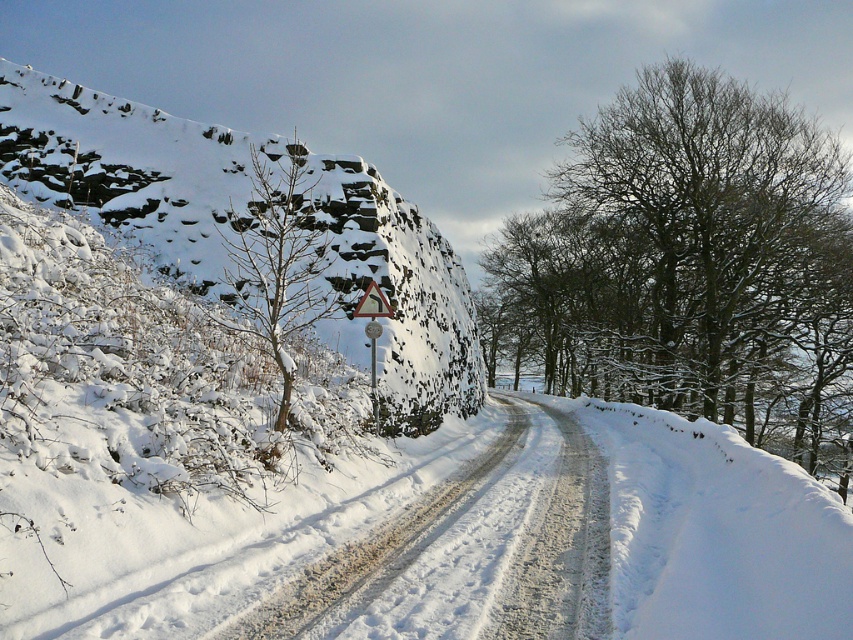
Question: Is rocky snow-covered hillside at upper left below white snow-covered road at center?

Choices:
 (A) no
 (B) yes

Answer: (A)

Question: Can you confirm if rocky snow-covered hillside at upper left is wider than white snow-covered road at center?

Choices:
 (A) yes
 (B) no

Answer: (A)

Question: Which point appears closest to the camera in this image?

Choices:
 (A) (175, 227)
 (B) (251, 150)

Answer: (A)

Question: Which object is the closest to the rocky snow-covered hillside at upper left?

Choices:
 (A) white snow-covered road at center
 (B) bare branches at center
 (C) snow-covered tree at center-left

Answer: (C)

Question: Observing the image, what is the correct spatial positioning of rocky snow-covered hillside at upper left in reference to snow-covered tree at center-left?

Choices:
 (A) above
 (B) below

Answer: (A)

Question: Estimate the real-world distances between objects in this image. Which object is farther from the white snow-covered road at center?

Choices:
 (A) bare branches at center
 (B) snow-covered tree at center-left
 (C) rocky snow-covered hillside at upper left

Answer: (A)